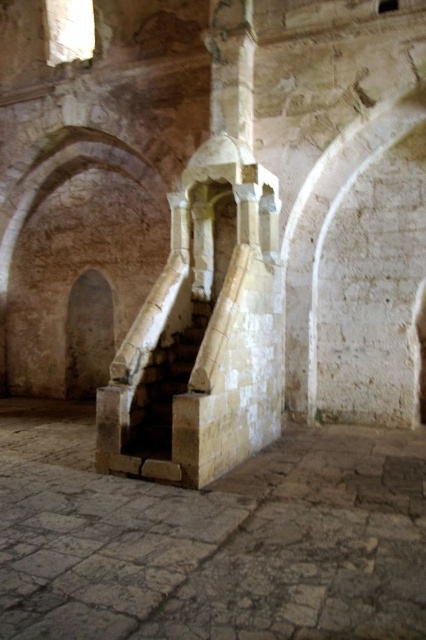
You are standing at the base of the staircase in the ancient stone structure. You notice two points marked on the wall. The first point is at coordinates point (178, 541) and the second is at point (164, 429). Which point is closer to you?

The point at (178, 541) is closer to you than the point at (164, 429).

You are standing at the bottom of the stone stairs at center and want to climb up to the stone textured stairs at center. Which direction should you move to reach them?

The stone textured stairs at center are above the stone stairs at center, so you should move upward to reach them.

You are standing at the bottom of the stone stairs at center and want to climb up to the stone textured stairs at center. Which direction should you face to move towards them?

Since the stone stairs at center are in front of the stone textured stairs at center, you should face forward to move towards them.